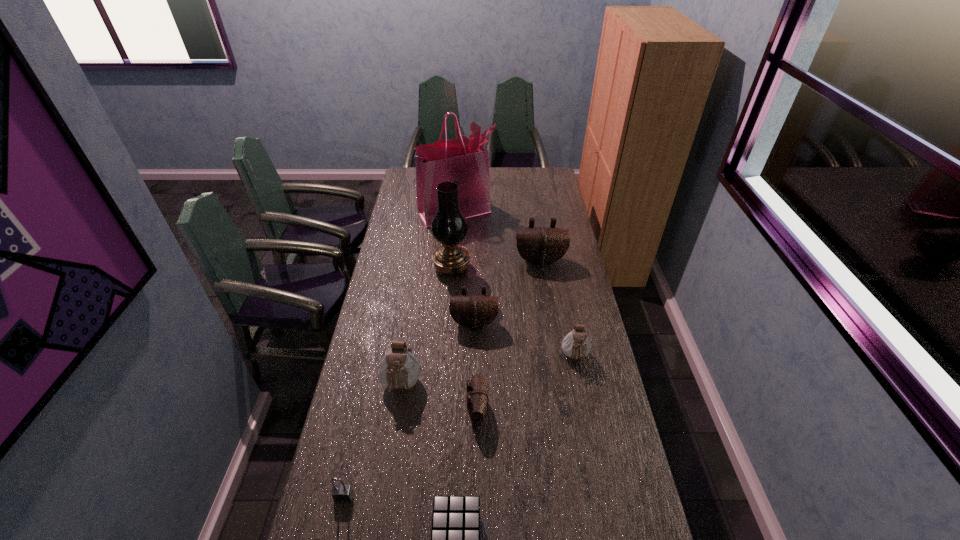
Image resolution: width=960 pixels, height=540 pixels. I want to click on pink shopping bag, so click(x=464, y=161).

The height and width of the screenshot is (540, 960). What are the coordinates of `the tallest object` in the screenshot? It's located at (464, 161).

The width and height of the screenshot is (960, 540). In order to click on brown oil lamp in this screenshot , I will do `click(449, 226)`.

Locate an element on the screen. This screenshot has width=960, height=540. oil lamp is located at coordinates (449, 226).

Find the location of a particular element. The height and width of the screenshot is (540, 960). the farthest pouch is located at coordinates (541, 246).

The height and width of the screenshot is (540, 960). Find the location of `the biggest brown pouch`. the biggest brown pouch is located at coordinates coord(541,246).

Locate an element on the screen. the leftmost pouch is located at coordinates click(x=399, y=369).

Find the location of a particular element. Image resolution: width=960 pixels, height=540 pixels. the left white pouch is located at coordinates (399, 369).

What are the coordinates of `the fourth farthest object` in the screenshot? It's located at point(473,311).

Where is `the second biggest brown pouch`? the second biggest brown pouch is located at coordinates (473, 311).